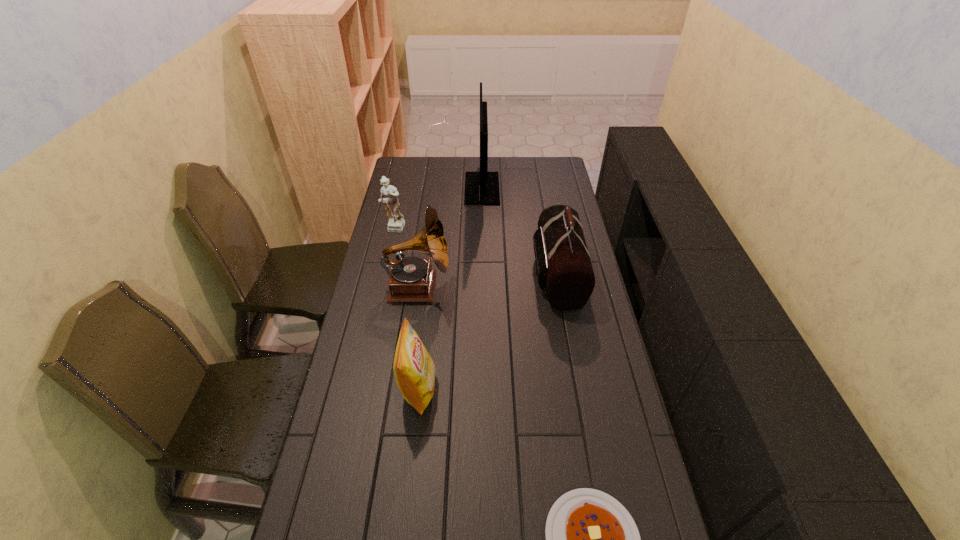
At what (x,y) coordinates should I click in order to perform the action: click on free space located 0.090m on the front pocket of the duffel bag. Please return your answer as a coordinate pair (x, y). This screenshot has width=960, height=540. Looking at the image, I should click on (510, 274).

Where is `vacant space located 0.310m on the front pocket of the duffel bag`? vacant space located 0.310m on the front pocket of the duffel bag is located at coordinates (452, 274).

I want to click on vacant space located 0.140m on the front pocket of the duffel bag, so click(x=496, y=274).

You are a GUI agent. You are given a task and a screenshot of the screen. Output one action in this format:
    pyautogui.click(x=<x>, y=<y>)
    Task: Click on the free space located 0.250m on the front-facing side of the figurine
    The height and width of the screenshot is (540, 960).
    Given the screenshot: What is the action you would take?
    pyautogui.click(x=382, y=279)

At what (x,y) coordinates should I click in order to perform the action: click on free space located on the front-facing side of the crisp (potato chip). Please return your answer as a coordinate pair (x, y). The width and height of the screenshot is (960, 540). Looking at the image, I should click on (489, 389).

What are the coordinates of `object that is at the far edge` in the screenshot? It's located at (481, 188).

Find the location of a particular element. phonograph_record located in the left edge section of the desktop is located at coordinates (411, 279).

Where is `figurine that is positioned at the left edge`? figurine that is positioned at the left edge is located at coordinates (396, 224).

At what (x,y) coordinates should I click in order to perform the action: click on object at the right edge. Please return your answer as a coordinate pair (x, y). Image resolution: width=960 pixels, height=540 pixels. Looking at the image, I should click on (563, 266).

You are a GUI agent. You are given a task and a screenshot of the screen. Output one action in this format:
    pyautogui.click(x=<x>, y=<y>)
    Task: Click on the vacant position at the left edge of the desktop
    Image resolution: width=960 pixels, height=540 pixels.
    Given the screenshot: What is the action you would take?
    pyautogui.click(x=379, y=348)